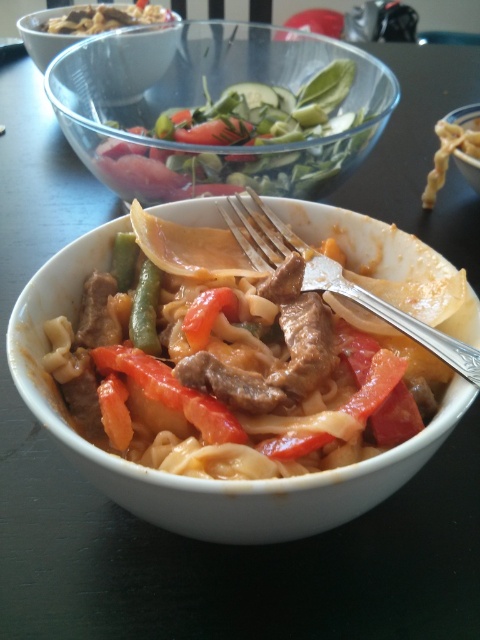
Question: Which object is positioned closest to the matte white bowl at upper center?

Choices:
 (A) matte ceramic bowl at center
 (B) green matte beans at center
 (C) silver metallic fork at center

Answer: (C)

Question: Is matte white bowl at upper center further to the viewer compared to green matte beans at center?

Choices:
 (A) yes
 (B) no

Answer: (A)

Question: Among these points, which one is nearest to the camera?

Choices:
 (A) (36, 65)
 (B) (142, 330)

Answer: (B)

Question: Is the position of matte white bowl at upper center less distant than that of green matte beans at center?

Choices:
 (A) no
 (B) yes

Answer: (A)

Question: Observing the image, what is the correct spatial positioning of transparent glass bowl at upper center in reference to matte white bowl at upper center?

Choices:
 (A) left
 (B) right

Answer: (B)

Question: Estimate the real-world distances between objects in this image. Which object is farther from the matte ceramic bowl at center?

Choices:
 (A) green matte beans at center
 (B) silver metallic fork at center

Answer: (A)